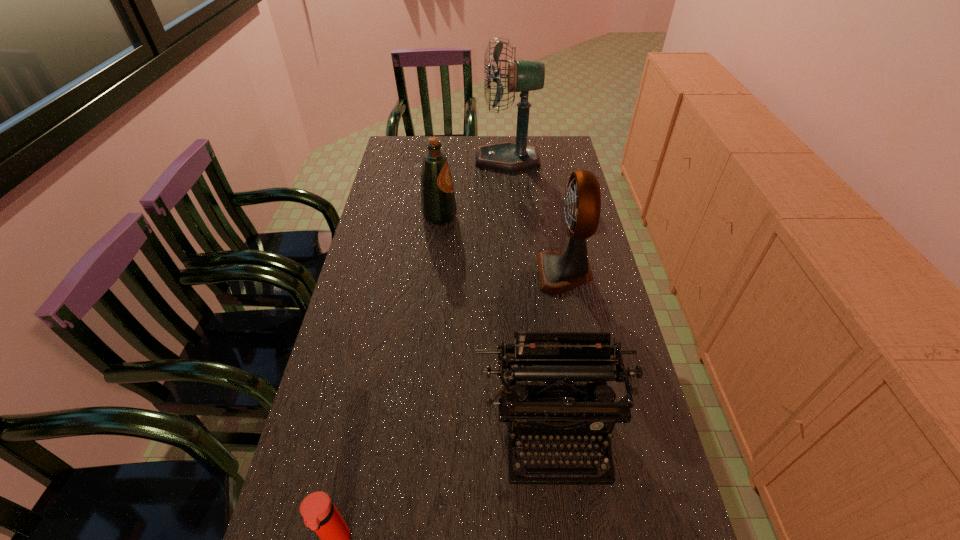
The width and height of the screenshot is (960, 540). In order to click on vacant space at the far left corner of the desktop in this screenshot , I will do `click(420, 137)`.

Find the location of a particular element. vacant position at the far right corner of the desktop is located at coordinates (547, 145).

Locate an element on the screen. The width and height of the screenshot is (960, 540). empty space that is in between the third nearest object and the farthest object is located at coordinates (536, 216).

Identify the location of empty location between the farther fan and the third farthest object. coord(536,216).

Find the location of a particular element. vacant space that's between the second nearest object and the fourth nearest object is located at coordinates (496, 322).

This screenshot has height=540, width=960. Find the location of `free space between the typewriter and the tallest object`. free space between the typewriter and the tallest object is located at coordinates (530, 294).

In order to click on object that is the nearest to the nearer fan in this screenshot , I will do `click(551, 357)`.

Select which object is the closest to the fourth farthest object. Please provide its 2D coordinates. Your answer should be formatted as a tuple, i.e. [(x, y)], where the tuple contains the x and y coordinates of a point satisfying the conditions above.

[(320, 514)]

Image resolution: width=960 pixels, height=540 pixels. I want to click on blank area in the image that satisfies the following two spatial constraints: 1. on the front-facing side of the nearer fan; 2. on the keyboard of the second nearest object, so click(595, 428).